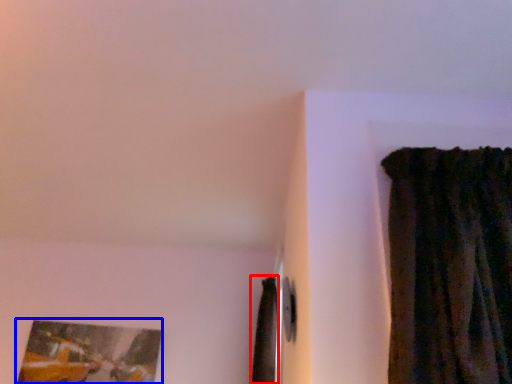
Question: Which of the following is the closest to the observer, curtain (highlighted by a red box) or picture frame (highlighted by a blue box)?

Choices:
 (A) curtain
 (B) picture frame

Answer: (A)